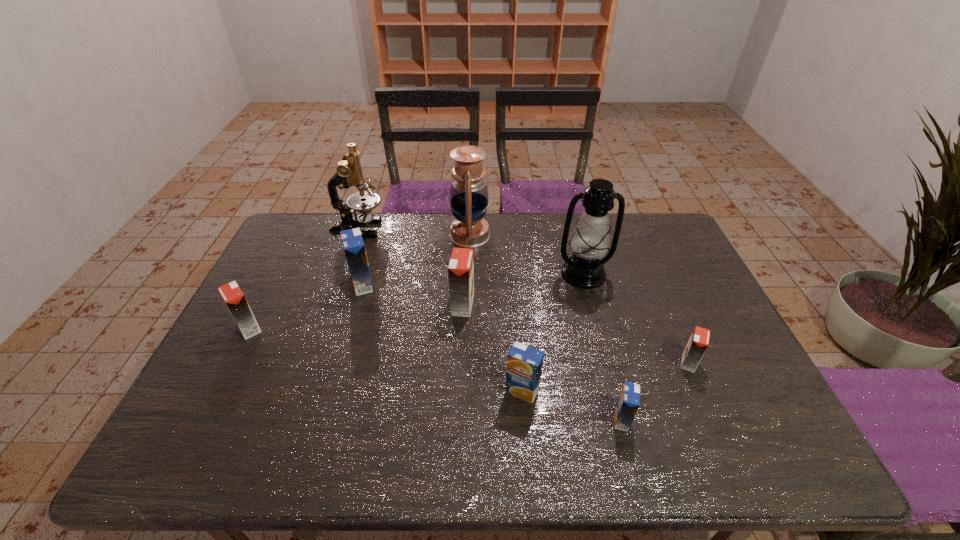
This screenshot has height=540, width=960. I want to click on object that is the sixth closest to the leftmost blue orange_juice, so click(x=590, y=241).

In order to click on orange_juice that is the fourth nearest to the gray microscope in this screenshot , I will do `click(524, 364)`.

You are a GUI agent. You are given a task and a screenshot of the screen. Output one action in this format:
    pyautogui.click(x=<x>, y=<y>)
    Task: Click on the third closest orange_juice to the rightmost orange_juice
    
    Given the screenshot: What is the action you would take?
    pyautogui.click(x=461, y=266)

Choose which blue orange_juice is the third nearest neighbor to the gray microscope. Please provide its 2D coordinates. Your answer should be formatted as a tuple, i.e. [(x, y)], where the tuple contains the x and y coordinates of a point satisfying the conditions above.

[(628, 403)]

Identify which blue orange_juice is the second nearest to the fifth orange_juice from right to left. Please provide its 2D coordinates. Your answer should be formatted as a tuple, i.e. [(x, y)], where the tuple contains the x and y coordinates of a point satisfying the conditions above.

[(628, 403)]

Locate which orange orange juice ranks second in proximity to the biggest orange orange juice. Please provide its 2D coordinates. Your answer should be formatted as a tuple, i.e. [(x, y)], where the tuple contains the x and y coordinates of a point satisfying the conditions above.

[(699, 340)]

Choose which orange orange juice is the third nearest neighbor to the nearer oil lamp. Please provide its 2D coordinates. Your answer should be formatted as a tuple, i.e. [(x, y)], where the tuple contains the x and y coordinates of a point satisfying the conditions above.

[(232, 295)]

Image resolution: width=960 pixels, height=540 pixels. What are the coordinates of `vacant area that satisfies the following two spatial constraints: 1. at the eyepiece of the fourth orange_juice from right to left; 2. on the right side of the gray microscope` in the screenshot? It's located at (331, 306).

The image size is (960, 540). What are the coordinates of `vacant position in the image that satisfies the following two spatial constraints: 1. on the back side of the nearest blue orange_juice; 2. on the right side of the third nearest object` in the screenshot? It's located at (607, 363).

Locate an element on the screen. free location that satisfies the following two spatial constraints: 1. on the back side of the blue oil lamp; 2. on the left side of the biggest blue orange_juice is located at coordinates (377, 235).